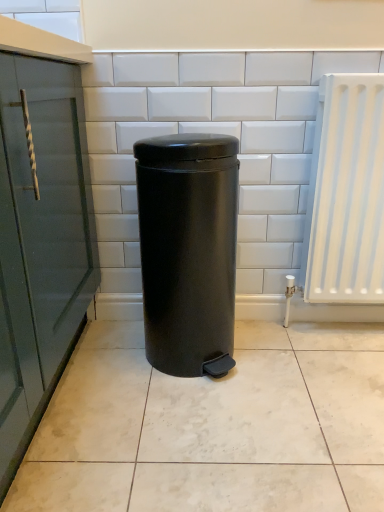
Identify the location of vacant area located to the right-hand side of matte black trash can at center. (292, 361).